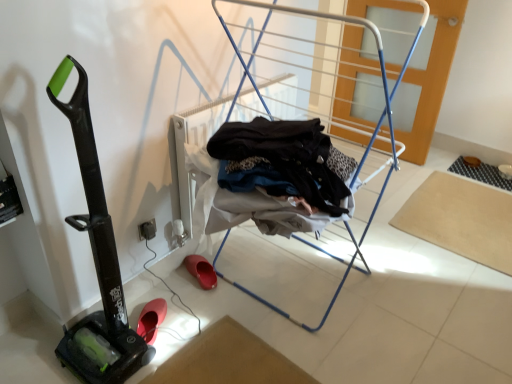
Locate an element on the screen. This screenshot has width=512, height=384. vacant region in front of beige fabric yoga mat at lower right is located at coordinates (453, 286).